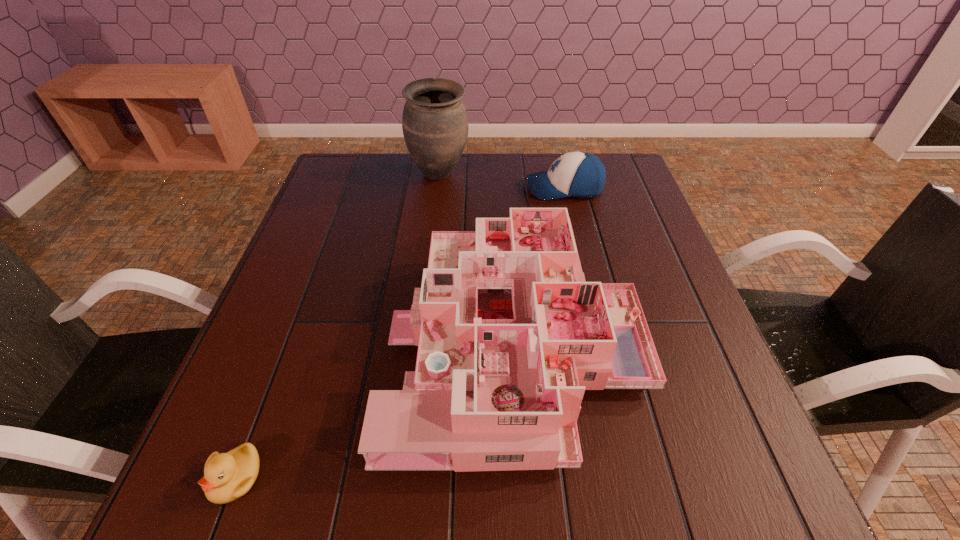
Locate an element on the screen. vacant space located on the front-facing side of the baseball cap is located at coordinates (464, 188).

Image resolution: width=960 pixels, height=540 pixels. I want to click on urn that is at the far edge, so click(435, 127).

The height and width of the screenshot is (540, 960). Find the location of `baseball cap that is at the far edge`. baseball cap that is at the far edge is located at coordinates (579, 174).

Where is `dollhouse that is positioned at the near edge`? The image size is (960, 540). dollhouse that is positioned at the near edge is located at coordinates (510, 335).

Where is `duckling positioned at the near edge`? The height and width of the screenshot is (540, 960). duckling positioned at the near edge is located at coordinates (227, 476).

Find the location of a particular element. object positioned at the left edge is located at coordinates (227, 476).

Identify the location of dollhouse located at the right edge. The width and height of the screenshot is (960, 540). (510, 335).

The width and height of the screenshot is (960, 540). I want to click on baseball cap that is at the right edge, so click(x=579, y=174).

I want to click on object that is at the near left corner, so click(x=227, y=476).

Where is `object present at the far right corner`? The height and width of the screenshot is (540, 960). object present at the far right corner is located at coordinates (579, 174).